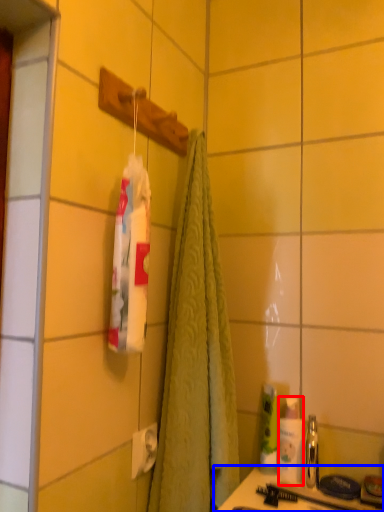
Question: Which of the following is the closest to the observer, toiletry (highlighted by a red box) or counter (highlighted by a blue box)?

Choices:
 (A) toiletry
 (B) counter

Answer: (B)